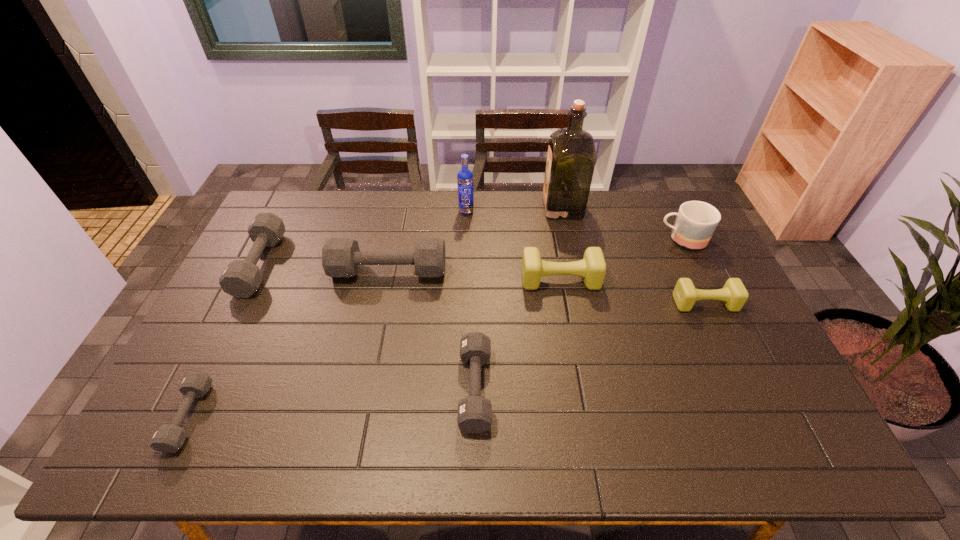
Locate an element on the screen. This screenshot has width=960, height=540. unoccupied area between the third smallest gray dumbbell and the eighth shortest object is located at coordinates (363, 238).

At what (x,y) coordinates should I click in order to perform the action: click on free spot between the rightmost dumbbell and the farther olive dumbbell. Please return your answer as a coordinate pair (x, y). Looking at the image, I should click on (633, 292).

You are a GUI agent. You are given a task and a screenshot of the screen. Output one action in this format:
    pyautogui.click(x=<x>, y=<y>)
    Task: Click on the vacant space that's between the second biggest gray dumbbell and the shortest object
    The height and width of the screenshot is (540, 960).
    Given the screenshot: What is the action you would take?
    pyautogui.click(x=225, y=340)

Where is `vacant point located between the nearer olive dumbbell and the second smallest gray dumbbell`? The width and height of the screenshot is (960, 540). vacant point located between the nearer olive dumbbell and the second smallest gray dumbbell is located at coordinates (590, 346).

The image size is (960, 540). In order to click on vacant area between the shortest object and the second biggest gray dumbbell in this screenshot , I will do `click(225, 340)`.

This screenshot has height=540, width=960. I want to click on empty space between the blue vodka and the third smallest gray dumbbell, so click(x=363, y=238).

Find the location of a particular element. The height and width of the screenshot is (540, 960). empty location between the shortest object and the second dumbbell from right to left is located at coordinates (374, 348).

Where is `free spot between the second smallest gray dumbbell and the shortest dumbbell`? This screenshot has width=960, height=540. free spot between the second smallest gray dumbbell and the shortest dumbbell is located at coordinates (332, 402).

Image resolution: width=960 pixels, height=540 pixels. I want to click on vacant space that's between the smallest gray dumbbell and the rightmost dumbbell, so click(446, 360).

Locate an element on the screen. This screenshot has height=540, width=960. object that is the closest to the seventh object from right to left is located at coordinates point(241,278).